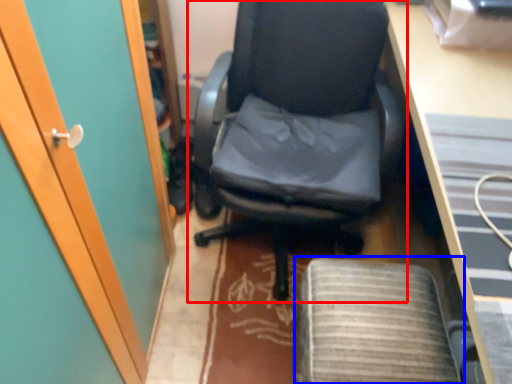
Question: Which object appears closest to the camera in this image, chair (highlighted by a red box) or computer chair (highlighted by a blue box)?

Choices:
 (A) chair
 (B) computer chair

Answer: (A)